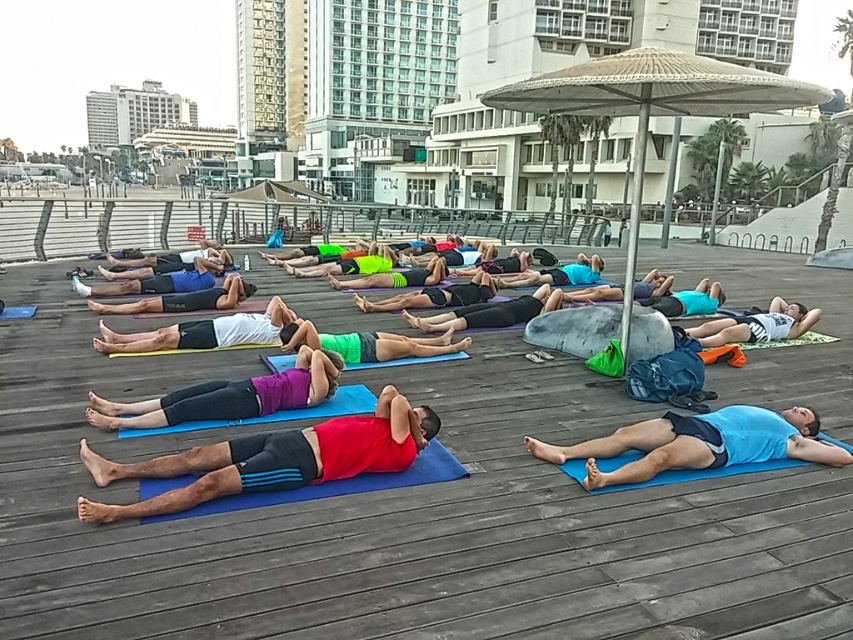
Based on the photo, you are a photographer positioned behind the group of people on the yoga mats. You want to take a photo where the blue rubber mat at center is visible to the left of the white cotton shirt at center. Is this possible based on their current positions?

Yes, because the blue rubber mat at center is already positioned to the left of the white cotton shirt at center, so the photographer can capture this arrangement in the photo.

You are a photographer taking a photo of the yoga session. You need to ensure that both the white cotton shirt at center and the blue rubber yoga mat at center are clearly visible in the frame. Which object should you focus on first to ensure depth of field captures both?

The white cotton shirt at center is much taller than the blue rubber yoga mat at center. To ensure both are in focus, focus on the white cotton shirt at center first since it is farther away, allowing the depth of field to include the closer blue rubber yoga mat at center.